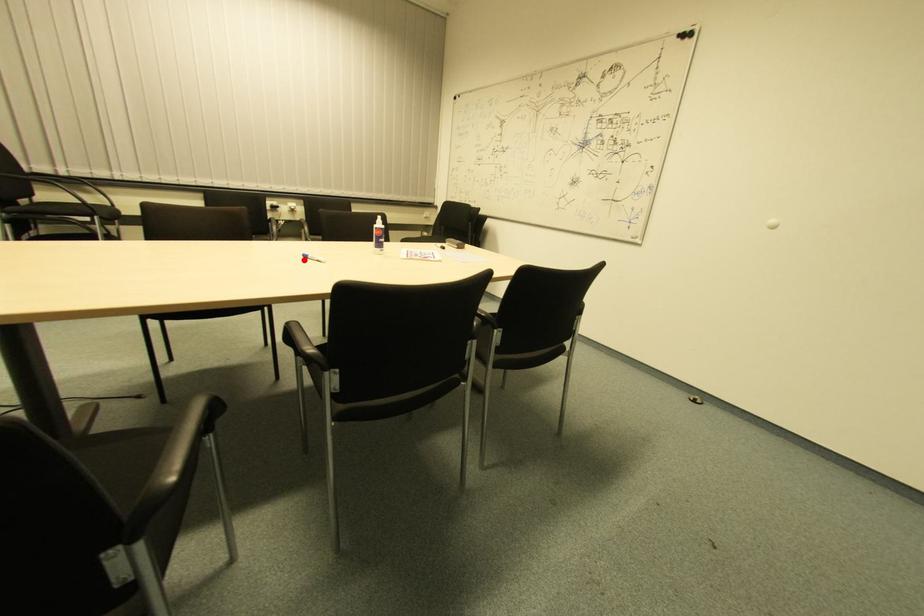
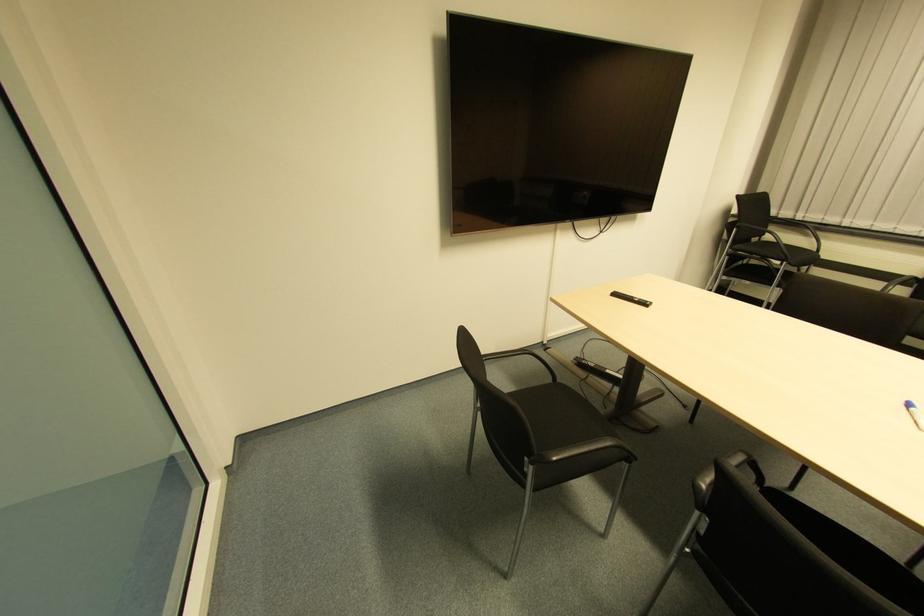
Question: I am providing you with two images of the same scene from different viewpoints. Image1 has a red point marked. In image2, the corresponding 3D location appears at what relative position? Reply with the corresponding letter.

Choices:
 (A) Closer
 (B) Farther

Answer: (B)